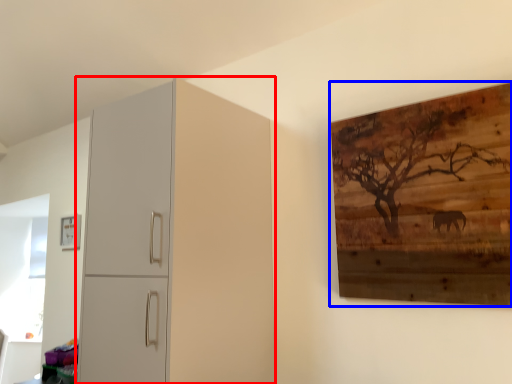
Question: Among these objects, which one is farthest to the camera, cupboard (highlighted by a red box) or picture frame (highlighted by a blue box)?

Choices:
 (A) cupboard
 (B) picture frame

Answer: (A)